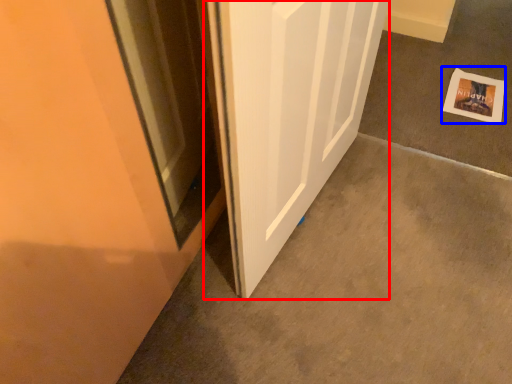
Question: Which point is further to the camera, door (highlighted by a red box) or postcard (highlighted by a blue box)?

Choices:
 (A) door
 (B) postcard

Answer: (B)